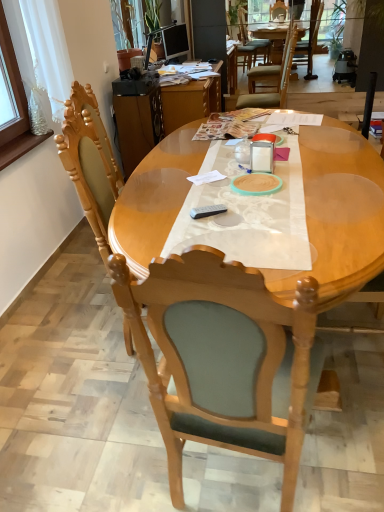
Question: Is green fabric chair at upper center, positioned as the 1th chair in back-to-front order, spatially inside light wood table at center, or outside of it?

Choices:
 (A) inside
 (B) outside

Answer: (B)

Question: From their relative heights in the image, would you say green fabric chair at upper center, which ranks as the first chair in right-to-left order, is taller or shorter than light wood table at center?

Choices:
 (A) tall
 (B) short

Answer: (B)

Question: Considering the real-world distances, which object is farthest from the wooden chair at center, which is counted as the first chair, starting from the front?

Choices:
 (A) light wood table at center
 (B) green fabric chair at upper center, the 2th chair when ordered from front to back
 (C) wooden desk at center

Answer: (B)

Question: Which object is positioned closest to the wooden desk at center?

Choices:
 (A) green fabric chair at upper center, which ranks as the first chair in right-to-left order
 (B) wooden chair at center, marked as the 1th chair in a bottom-to-top arrangement
 (C) light wood table at center

Answer: (A)